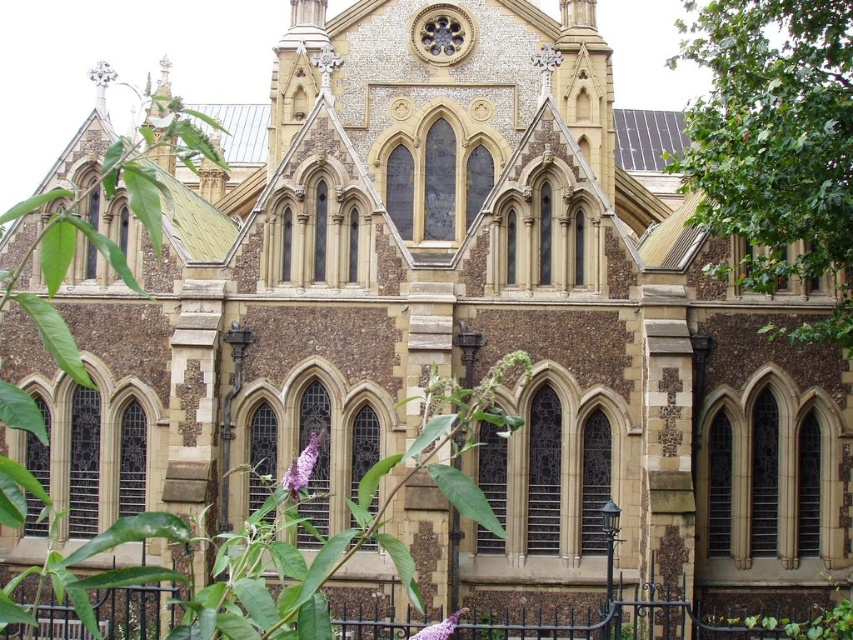
Question: In this image, where is green leafy tree at right located relative to purple matte flower at lower center?

Choices:
 (A) above
 (B) below

Answer: (A)

Question: Can you confirm if green leafy tree at right is positioned above purple matte flower at lower center?

Choices:
 (A) no
 (B) yes

Answer: (B)

Question: Considering the real-world distances, which object is closest to the purple matte flower at center?

Choices:
 (A) purple matte flower at lower center
 (B) green leafy tree at right

Answer: (A)

Question: Which of the following is the farthest from the observer?

Choices:
 (A) purple matte flower at center
 (B) green leafy tree at right

Answer: (B)

Question: Where is green leafy tree at right located in relation to purple matte flower at center in the image?

Choices:
 (A) left
 (B) right

Answer: (B)

Question: Estimate the real-world distances between objects in this image. Which object is farther from the purple matte flower at center?

Choices:
 (A) purple matte flower at lower center
 (B) green leafy tree at right

Answer: (B)